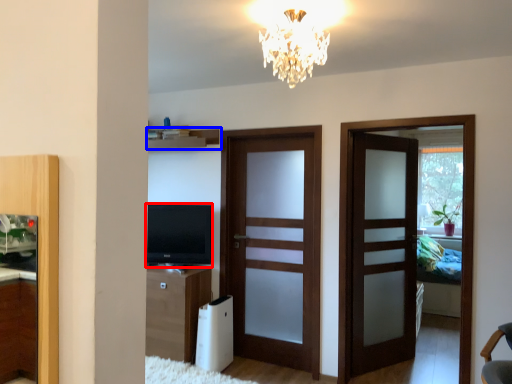
Question: Among these objects, which one is nearest to the camera, television (highlighted by a red box) or shelf (highlighted by a blue box)?

Choices:
 (A) television
 (B) shelf

Answer: (A)